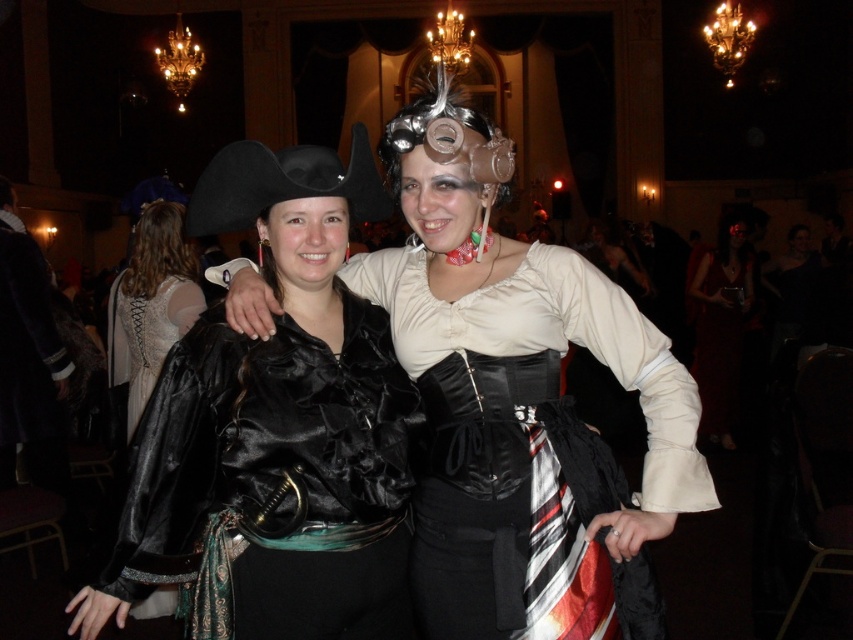
What object is located at the coordinate point (x=274, y=483) in the image?

The point (x=274, y=483) marks the location of the satin black vest at center.

You are at a fashion show and need to decide the order of the dresses displayed on the runway. Based on their positions in the image, which dress should be shown first, the matte black dress at center or the velvet red dress at center?

The velvet red dress at center should be shown first because the matte black dress at center is positioned under it, indicating it is lower in the display order.

You are a photographer at a themed event and need to arrange the two central outfits for a photo shoot. The satin black vest at center and the velvet red dress at center must be placed in a line. According to their current positions, which outfit should be placed to the left when arranging them in a straight line?

The satin black vest at center is already positioned on the left side of the velvet red dress at center, so when arranging them in a straight line, the satin black vest at center should be placed to the left of the velvet red dress at center to maintain their current spatial relationship.